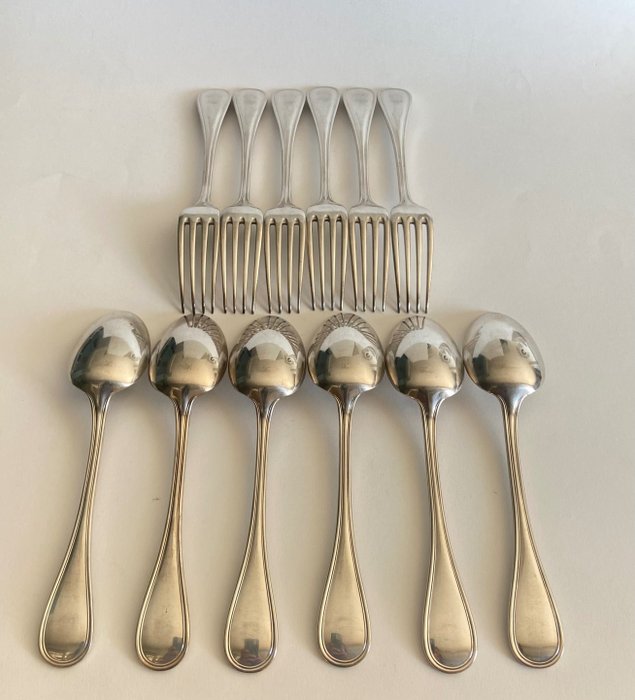
Where is `fork`? fork is located at coordinates (206, 172), (244, 167), (286, 168), (324, 162), (359, 155), (398, 158).